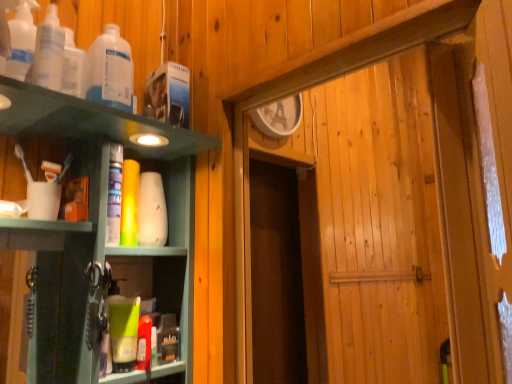
This screenshot has height=384, width=512. What do you see at coordinates (21, 41) in the screenshot?
I see `translucent plastic bottles at upper left, placed as the first bottle when sorted from front to back` at bounding box center [21, 41].

At what (x,y) coordinates should I click in order to perform the action: click on green matte tube at lower left, the 1th toiletry from the bottom. Please return your answer as a coordinate pair (x, y). This screenshot has width=512, height=384. Looking at the image, I should click on (124, 333).

Describe the element at coordinates (124, 333) in the screenshot. The width and height of the screenshot is (512, 384). I see `green matte tube at lower left, marked as the second toiletry in a top-to-bottom arrangement` at that location.

Identify the location of translucent plastic bottles at upper left, the second bottle from the back. (49, 51).

From a real-world perspective, who is located higher, white matte vase at center, which is counted as the 1th toiletry, starting from the back, or white matte cup at left?

white matte vase at center, which is counted as the 1th toiletry, starting from the back, is physically above.

Based on their sizes in the image, would you say white matte vase at center, the 2th toiletry ordered from the bottom, is bigger or smaller than white matte cup at left?

In the image, white matte vase at center, the 2th toiletry ordered from the bottom, appears to be larger than white matte cup at left.

From the image's perspective, relative to white matte cup at left, is white matte vase at center, the 2th toiletry ordered from the bottom, above or below?

white matte vase at center, the 2th toiletry ordered from the bottom, is situated lower than white matte cup at left in the image.

Considering the relative sizes of white matte vase at center, which is counted as the 1th toiletry, starting from the back, and white matte cup at left in the image provided, is white matte vase at center, which is counted as the 1th toiletry, starting from the back, thinner than white matte cup at left?

No, white matte vase at center, which is counted as the 1th toiletry, starting from the back, is not thinner than white matte cup at left.

From a real-world perspective, which object stands above the other?

white matte cup at left, from a real-world perspective.

The height and width of the screenshot is (384, 512). What are the coordinates of `the 1st toiletry behind the white matte cup at left` in the screenshot? It's located at (124, 333).

From the image's perspective, is green matte tube at lower left, positioned as the second toiletry in back-to-front order, on white matte cup at left?

No.

Considering the sizes of objects green matte tube at lower left, positioned as the second toiletry in back-to-front order, and white matte cup at left in the image provided, who is wider, green matte tube at lower left, positioned as the second toiletry in back-to-front order, or white matte cup at left?

green matte tube at lower left, positioned as the second toiletry in back-to-front order.

Is the surface of white matte cup at left in direct contact with translucent plastic bottle at upper left, arranged as the 3th bottle when viewed from the front?

No, white matte cup at left is not making contact with translucent plastic bottle at upper left, arranged as the 3th bottle when viewed from the front.

Looking at the image, does white matte cup at left seem bigger or smaller compared to translucent plastic bottle at upper left, arranged as the 3th bottle when viewed from the front?

Considering their sizes, white matte cup at left takes up less space than translucent plastic bottle at upper left, arranged as the 3th bottle when viewed from the front.

Considering the relative positions of white matte cup at left and translucent plastic bottle at upper left, arranged as the 3th bottle when viewed from the front, in the image provided, is white matte cup at left to the left of translucent plastic bottle at upper left, arranged as the 3th bottle when viewed from the front, from the viewer's perspective?

Indeed, white matte cup at left is positioned on the left side of translucent plastic bottle at upper left, arranged as the 3th bottle when viewed from the front.

Is white matte cup at left looking in the opposite direction of translucent plastic bottle at upper left, arranged as the 3th bottle when viewed from the front?

No.

Does white matte vase at center, positioned as the second toiletry in front-to-back order, touch green matte tube at lower left, the 1th toiletry from the bottom?

No, white matte vase at center, positioned as the second toiletry in front-to-back order, is not with green matte tube at lower left, the 1th toiletry from the bottom.

Who is bigger, white matte vase at center, which is counted as the 1th toiletry, starting from the back, or green matte tube at lower left, positioned as the second toiletry in back-to-front order?

With larger size is white matte vase at center, which is counted as the 1th toiletry, starting from the back.

Would you say white matte vase at center, the 1th toiletry from the top, is outside green matte tube at lower left, positioned as the second toiletry in back-to-front order?

Yes.

Is green matte tube at lower left, the first toiletry viewed from the front, not close to translucent plastic bottles at upper left, the second bottle from the back?

No, there isn't a large distance between green matte tube at lower left, the first toiletry viewed from the front, and translucent plastic bottles at upper left, the second bottle from the back.

Which of these two, green matte tube at lower left, the 1th toiletry from the bottom, or translucent plastic bottles at upper left, which is the second bottle in front-to-back order, stands taller?

With more height is translucent plastic bottles at upper left, which is the second bottle in front-to-back order.

From the image's perspective, which one is positioned higher, green matte tube at lower left, marked as the second toiletry in a top-to-bottom arrangement, or translucent plastic bottles at upper left, the second bottle from the back?

From the image's view, translucent plastic bottles at upper left, the second bottle from the back, is above.

Does point (124, 324) come in front of point (42, 71)?

No, (124, 324) is behind (42, 71).

Does point (28, 6) appear closer or farther from the camera than point (127, 43)?

Clearly, point (28, 6) is closer to the camera than point (127, 43).

Can you tell me how much translucent plastic bottles at upper left, which is the 3th bottle from back to front, and translucent plastic bottle at upper left, arranged as the 3th bottle when viewed from the front, differ in facing direction?

0.0016 degrees.

From a real-world perspective, does translucent plastic bottles at upper left, placed as the first bottle when sorted from front to back, stand above translucent plastic bottle at upper left, arranged as the 3th bottle when viewed from the front?

Yes.

Is translucent plastic bottles at upper left, which is the 3th bottle from back to front, not close to translucent plastic bottle at upper left, the 1th bottle positioned from the back?

Actually, translucent plastic bottles at upper left, which is the 3th bottle from back to front, and translucent plastic bottle at upper left, the 1th bottle positioned from the back, are a little close together.

Considering the sizes of objects translucent plastic bottle at upper left, the 1th bottle positioned from the back, and white matte cup at left in the image provided, who is thinner, translucent plastic bottle at upper left, the 1th bottle positioned from the back, or white matte cup at left?

With smaller width is white matte cup at left.

How distant is translucent plastic bottle at upper left, arranged as the 3th bottle when viewed from the front, from white matte cup at left?

translucent plastic bottle at upper left, arranged as the 3th bottle when viewed from the front, is 27.63 centimeters from white matte cup at left.

Is translucent plastic bottle at upper left, arranged as the 3th bottle when viewed from the front, not within white matte cup at left?

Yes, translucent plastic bottle at upper left, arranged as the 3th bottle when viewed from the front, is not within white matte cup at left.

Locate an element on the screen. The height and width of the screenshot is (384, 512). coffee cup located on the left of white matte vase at center, the 2th toiletry ordered from the bottom is located at coordinates (42, 200).

From the white matte cup at left, count 1st toiletrys backward and point to it. Please provide its 2D coordinates.

[(124, 333)]

Which object lies further to the anchor point translucent plastic bottles at upper left, placed as the first bottle when sorted from front to back, white matte vase at center, the 1th toiletry from the top, or translucent plastic bottles at upper left, which is the second bottle in front-to-back order?

Among the two, white matte vase at center, the 1th toiletry from the top, is located further to translucent plastic bottles at upper left, placed as the first bottle when sorted from front to back.

Estimate the real-world distances between objects in this image. Which object is closer to white matte vase at center, the 1th toiletry from the top, translucent plastic bottles at upper left, the second bottle from the back, or white matte cup at left?

white matte cup at left is closer to white matte vase at center, the 1th toiletry from the top.

When comparing their distances from green matte tube at lower left, the 1th toiletry from the bottom, does translucent plastic bottles at upper left, which is the second bottle in front-to-back order, or translucent plastic bottles at upper left, placed as the first bottle when sorted from front to back, seem closer?

The object closer to green matte tube at lower left, the 1th toiletry from the bottom, is translucent plastic bottles at upper left, which is the second bottle in front-to-back order.

When comparing their distances from translucent plastic bottles at upper left, which is the second bottle in front-to-back order, does white matte cup at left or translucent plastic bottle at upper left, the 1th bottle positioned from the back, seem closer?

translucent plastic bottle at upper left, the 1th bottle positioned from the back, is positioned closer to the anchor translucent plastic bottles at upper left, which is the second bottle in front-to-back order.

Estimate the real-world distances between objects in this image. Which object is further from translucent plastic bottles at upper left, the second bottle from the back, green matte tube at lower left, the first toiletry viewed from the front, or white matte cup at left?

green matte tube at lower left, the first toiletry viewed from the front, is positioned further to the anchor translucent plastic bottles at upper left, the second bottle from the back.

Looking at the image, which one is located closer to translucent plastic bottle at upper left, arranged as the 3th bottle when viewed from the front, white matte vase at center, the 2th toiletry ordered from the bottom, or green matte tube at lower left, the 1th toiletry from the bottom?

white matte vase at center, the 2th toiletry ordered from the bottom, is positioned closer to the anchor translucent plastic bottle at upper left, arranged as the 3th bottle when viewed from the front.

Based on their spatial positions, is white matte vase at center, the 2th toiletry ordered from the bottom, or translucent plastic bottles at upper left, which is the 3th bottle from back to front, closer to white matte cup at left?

white matte vase at center, the 2th toiletry ordered from the bottom, lies closer to white matte cup at left than the other object.

Considering their positions, is white matte vase at center, positioned as the second toiletry in front-to-back order, positioned further to green matte tube at lower left, the first toiletry viewed from the front, than translucent plastic bottles at upper left, placed as the first bottle when sorted from front to back?

translucent plastic bottles at upper left, placed as the first bottle when sorted from front to back, is further to green matte tube at lower left, the first toiletry viewed from the front.

Identify the location of coffee cup between translucent plastic bottles at upper left, which is the second bottle in front-to-back order, and white matte vase at center, the 2th toiletry ordered from the bottom, from top to bottom. Image resolution: width=512 pixels, height=384 pixels. (42, 200).

This screenshot has height=384, width=512. I want to click on coffee cup between translucent plastic bottles at upper left, which is the 3th bottle from back to front, and white matte vase at center, the 2th toiletry ordered from the bottom, from front to back, so click(42, 200).

Locate an element on the screen. This screenshot has width=512, height=384. toiletry between translucent plastic bottles at upper left, which is the second bottle in front-to-back order, and green matte tube at lower left, the 1th toiletry from the bottom, in the vertical direction is located at coordinates (151, 211).

Locate an element on the screen. bottle positioned between translucent plastic bottles at upper left, placed as the first bottle when sorted from front to back, and translucent plastic bottle at upper left, the 1th bottle positioned from the back, from near to far is located at coordinates (49, 51).